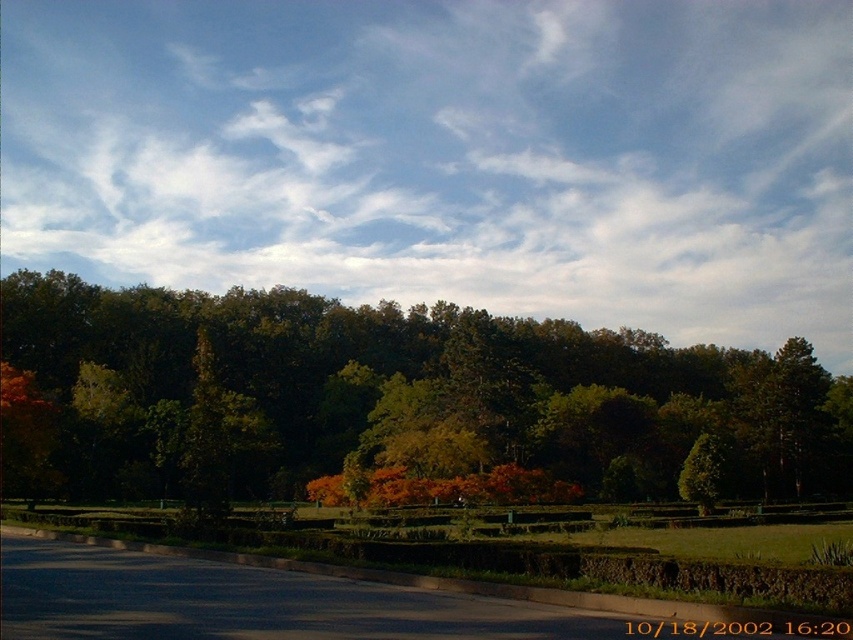
What are the coordinates of the white fluffy cloud at upper center?

The white fluffy cloud at upper center is located at coordinates point (447, 154).